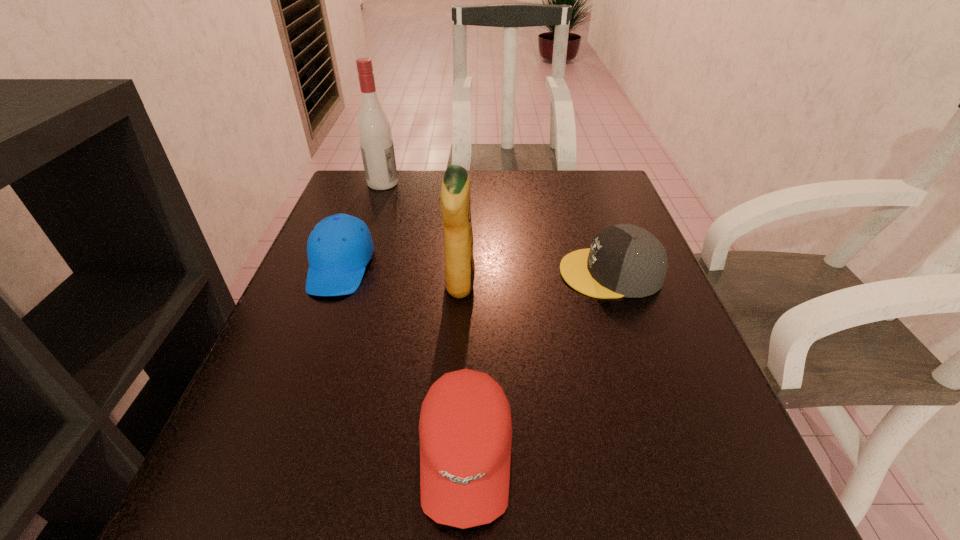
You are a GUI agent. You are given a task and a screenshot of the screen. Output one action in this format:
    pyautogui.click(x=<x>, y=<y>)
    Task: Click on the vacant area situated on the front-facing side of the rightmost cap
    This screenshot has width=960, height=540.
    Given the screenshot: What is the action you would take?
    pyautogui.click(x=394, y=273)

Image resolution: width=960 pixels, height=540 pixels. In order to click on vacant space located on the front-facing side of the rightmost cap in this screenshot , I will do `click(408, 273)`.

The image size is (960, 540). What are the coordinates of `free space located 0.270m on the front-facing side of the rightmost cap` in the screenshot? It's located at (432, 273).

Locate an element on the screen. This screenshot has width=960, height=540. object that is at the far edge is located at coordinates (374, 130).

Find the location of a particular element. The image size is (960, 540). object that is positioned at the near edge is located at coordinates (465, 428).

You are a GUI agent. You are given a task and a screenshot of the screen. Output one action in this format:
    pyautogui.click(x=<x>, y=<y>)
    Task: Click on the alcohol positioned at the left edge
    
    Given the screenshot: What is the action you would take?
    pyautogui.click(x=374, y=130)

Image resolution: width=960 pixels, height=540 pixels. Identify the location of cap located at the left edge. (339, 247).

This screenshot has height=540, width=960. Find the location of `object positioned at the right edge`. object positioned at the right edge is located at coordinates (624, 260).

Where is `object located in the far left corner section of the desktop`? This screenshot has height=540, width=960. object located in the far left corner section of the desktop is located at coordinates (374, 130).

The image size is (960, 540). In the image, there is a desktop. In order to click on vacant area at the far edge in this screenshot , I will do `click(555, 186)`.